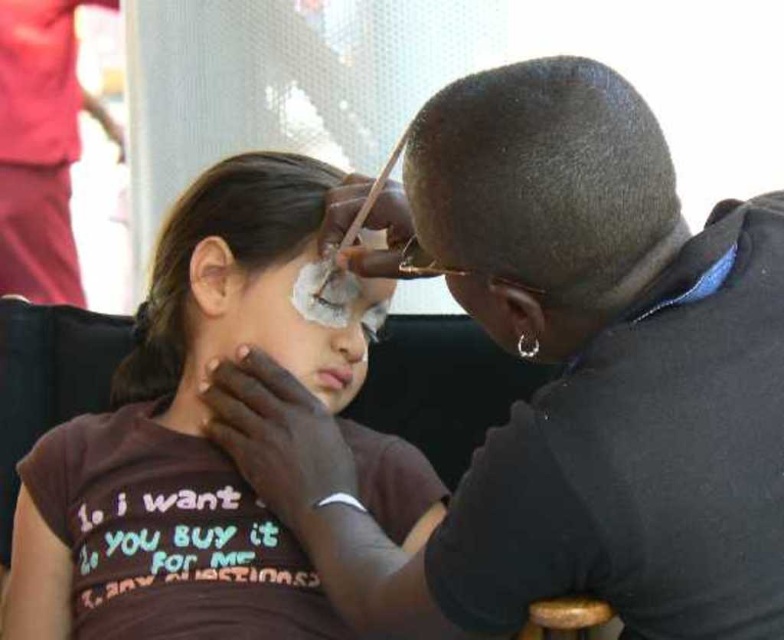
Who is higher up, matte brown shirt at center or white matte face paint at center?

white matte face paint at center is above.

Can you confirm if matte brown shirt at center is wider than white matte face paint at center?

Yes, matte brown shirt at center is wider than white matte face paint at center.

You are a GUI agent. You are given a task and a screenshot of the screen. Output one action in this format:
    pyautogui.click(x=<x>, y=<y>)
    Task: Click on the matte brown shirt at center
    
    Given the screenshot: What is the action you would take?
    pyautogui.click(x=189, y=435)

Can you confirm if smooth skin face paint at upper center is taller than white matte face paint at center?

Indeed, smooth skin face paint at upper center has a greater height compared to white matte face paint at center.

Does point (383, 589) lie in front of point (273, 268)?

Yes, it is in front of point (273, 268).

Find the location of a particular element. The image size is (784, 640). smooth skin face paint at upper center is located at coordinates (561, 381).

Who is positioned more to the left, smooth skin face paint at upper center or matte black face at upper center?

Positioned to the left is matte black face at upper center.

Who is taller, smooth skin face paint at upper center or matte black face at upper center?

Standing taller between the two is smooth skin face paint at upper center.

Does point (625, 156) come farther from viewer compared to point (516, 308)?

No.

Where is `smooth skin face paint at upper center`? smooth skin face paint at upper center is located at coordinates (561, 381).